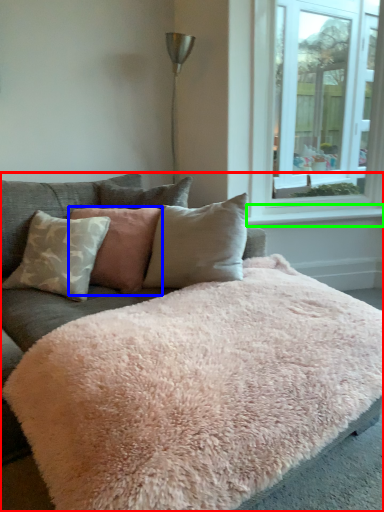
Question: Which is nearer to the studio couch (highlighted by a red box)? pillow (highlighted by a blue box) or window sill (highlighted by a green box).

Choices:
 (A) pillow
 (B) window sill

Answer: (A)